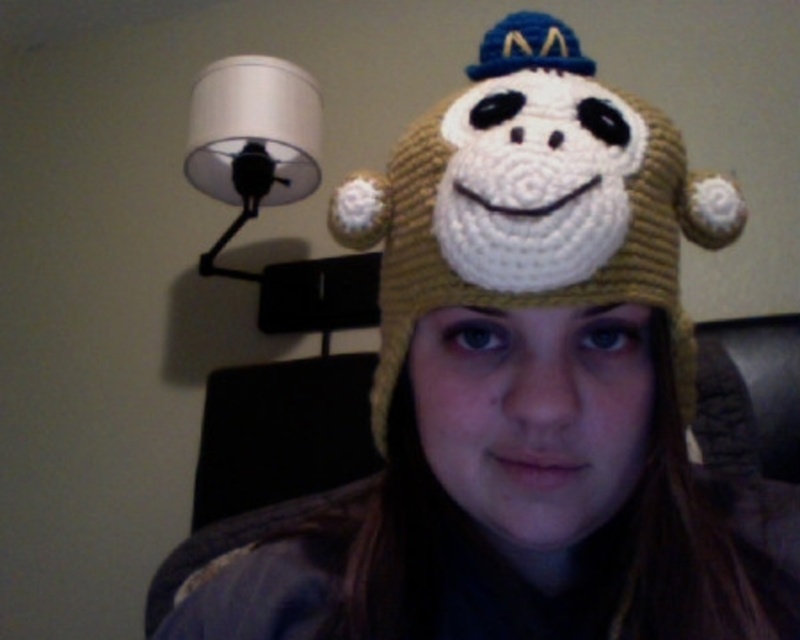
Question: Does yarn knitted hat at center have a lesser width compared to white matte lampshade at upper left?

Choices:
 (A) yes
 (B) no

Answer: (A)

Question: Which point is farther to the camera?

Choices:
 (A) (290, 200)
 (B) (545, 22)

Answer: (A)

Question: Considering the relative positions of yarn knitted hat at center and white matte lampshade at upper left in the image provided, where is yarn knitted hat at center located with respect to white matte lampshade at upper left?

Choices:
 (A) left
 (B) right

Answer: (B)

Question: Among these points, which one is farthest from the camera?

Choices:
 (A) (236, 172)
 (B) (492, 52)

Answer: (A)

Question: Does yarn knitted hat at center appear over white matte lampshade at upper left?

Choices:
 (A) yes
 (B) no

Answer: (B)